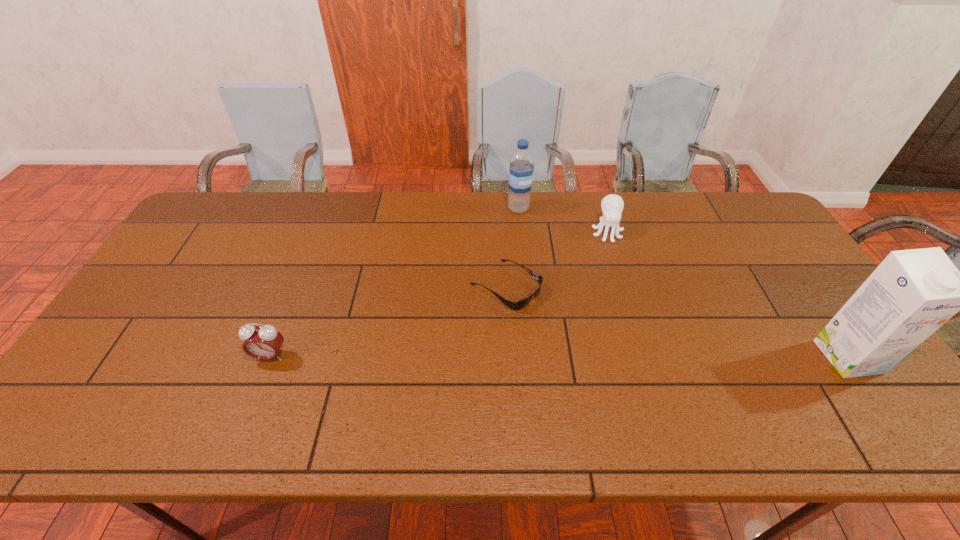
Find the location of `vacant region that satisfies the following two spatial constraints: 1. on the clock face of the tallest object; 2. on the right side of the alarm clock`. vacant region that satisfies the following two spatial constraints: 1. on the clock face of the tallest object; 2. on the right side of the alarm clock is located at coordinates (270, 356).

I want to click on free space that satisfies the following two spatial constraints: 1. on the front side of the sunglasses; 2. on the right side of the rightmost object, so click(x=510, y=356).

The height and width of the screenshot is (540, 960). Identify the location of free location that satisfies the following two spatial constraints: 1. on the front side of the carton; 2. on the right side of the octopus. (645, 356).